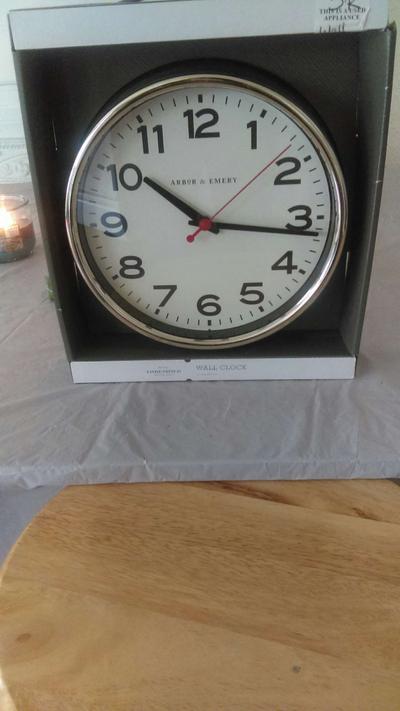
Find the location of a particular element. cutting board is located at coordinates (238, 624).